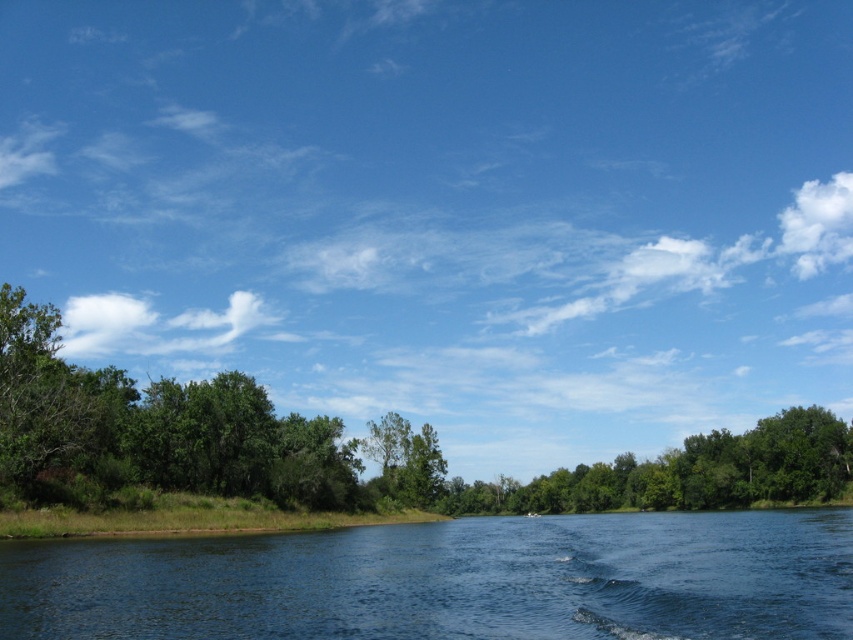
Is blue smooth water at center behind green leafy tree at lower center?

No, blue smooth water at center is in front of green leafy tree at lower center.

Is blue smooth water at center smaller than green leafy tree at lower center?

Yes, blue smooth water at center is smaller than green leafy tree at lower center.

Is point (570, 566) closer to viewer compared to point (682, 483)?

Yes, it is.

The width and height of the screenshot is (853, 640). Identify the location of blue smooth water at center. (450, 580).